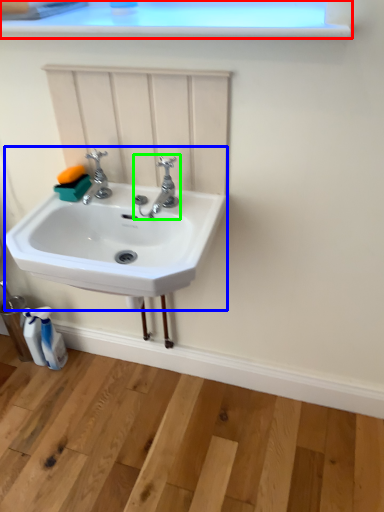
Question: Estimate the real-world distances between objects in this image. Which object is farther from window frame (highlighted by a red box), sink (highlighted by a blue box) or tap (highlighted by a green box)?

Choices:
 (A) sink
 (B) tap

Answer: (A)